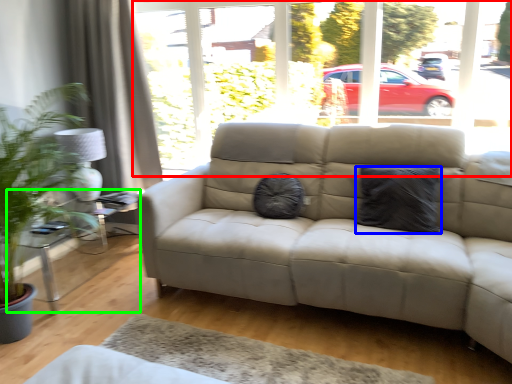
Question: Based on their relative distances, which object is nearer to window frame (highlighted by a red box)? Choose from pillow (highlighted by a blue box) and table (highlighted by a green box).

Choices:
 (A) pillow
 (B) table

Answer: (A)